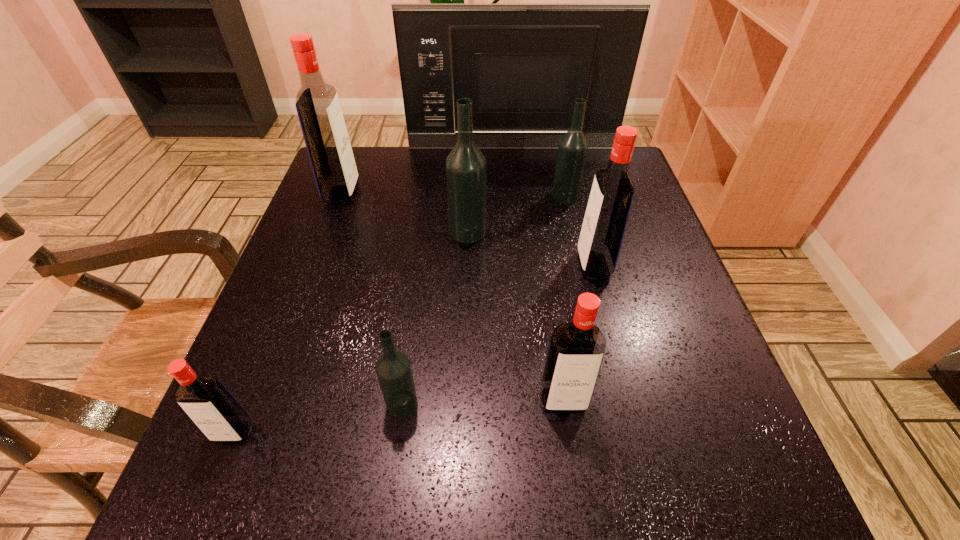
At what (x,y) coordinates should I click in order to perform the action: click on vodka positioned at the far right corner. Please return your answer as a coordinate pair (x, y). Looking at the image, I should click on (572, 149).

Image resolution: width=960 pixels, height=540 pixels. What are the coordinates of `vacant space at the near edge` in the screenshot? It's located at (324, 490).

Identify the location of vacant space at the left edge of the desktop. This screenshot has width=960, height=540. (254, 426).

This screenshot has height=540, width=960. What are the coordinates of `free space at the right edge` in the screenshot? It's located at (643, 300).

The image size is (960, 540). Find the location of `vacant area at the far left corner of the desktop`. vacant area at the far left corner of the desktop is located at coordinates (383, 170).

In the image, there is a desktop. Where is `blank space at the far right corner`? This screenshot has height=540, width=960. blank space at the far right corner is located at coordinates (608, 150).

The height and width of the screenshot is (540, 960). Find the location of `vacant space at the near right corner of the desktop`. vacant space at the near right corner of the desktop is located at coordinates (666, 489).

Find the location of a particular element. The height and width of the screenshot is (540, 960). blank region between the farthest black vodka and the nearest vodka is located at coordinates (399, 314).

Locate an element on the screen. The image size is (960, 540). vacant region between the microwave oven and the second biggest black vodka is located at coordinates (539, 172).

The width and height of the screenshot is (960, 540). Identify the location of empty space that is in between the fourth farthest object and the farthest black vodka. (516, 214).